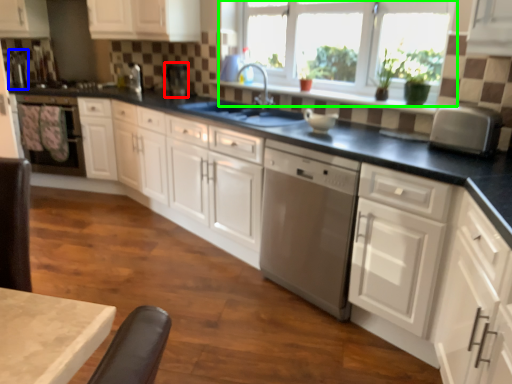
Question: Considering the real-world distances, which object is farthest from appliance (highlighted by a red box)? appliance (highlighted by a blue box) or window (highlighted by a green box)?

Choices:
 (A) appliance
 (B) window

Answer: (A)